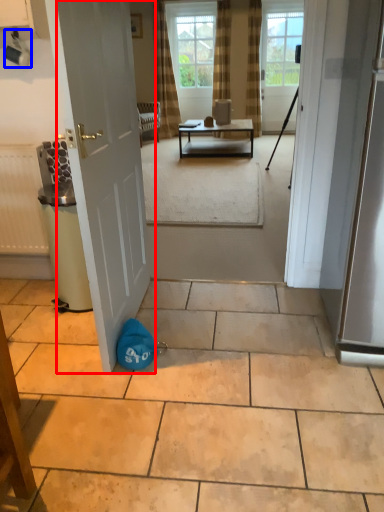
Question: Which object appears closest to the camera in this image, door (highlighted by a red box) or coffee cup (highlighted by a blue box)?

Choices:
 (A) door
 (B) coffee cup

Answer: (A)